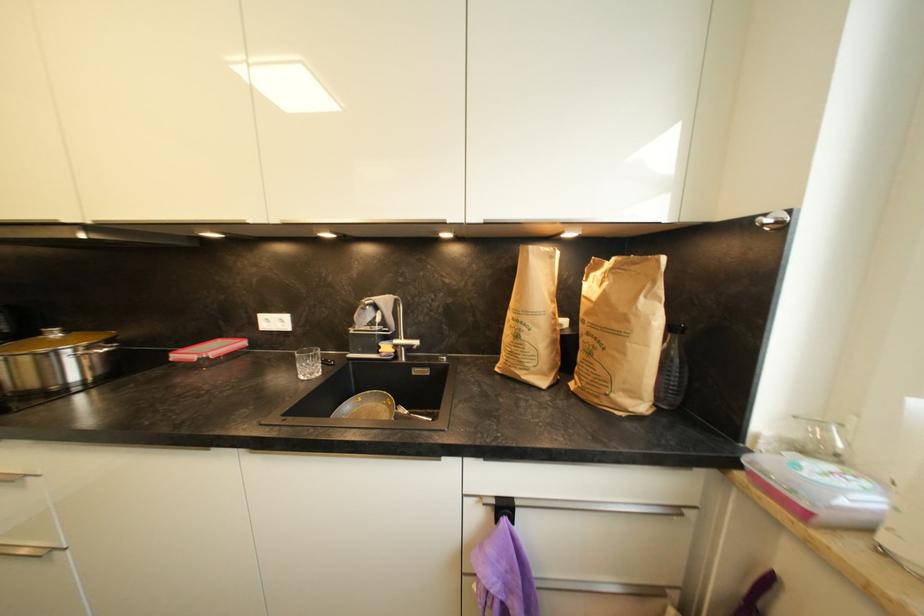
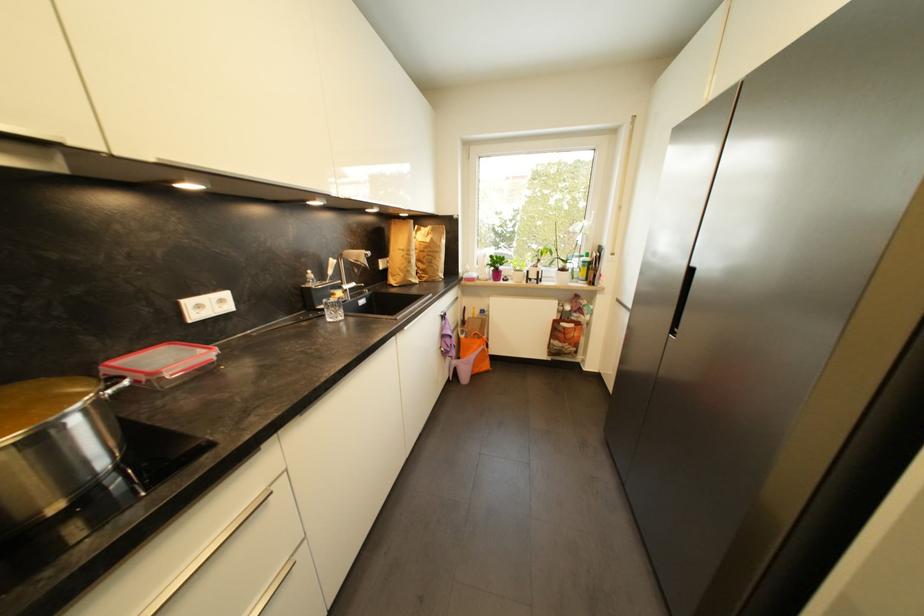
Find the pixel in the second image that matches (x=591, y=315) in the first image.

(430, 249)